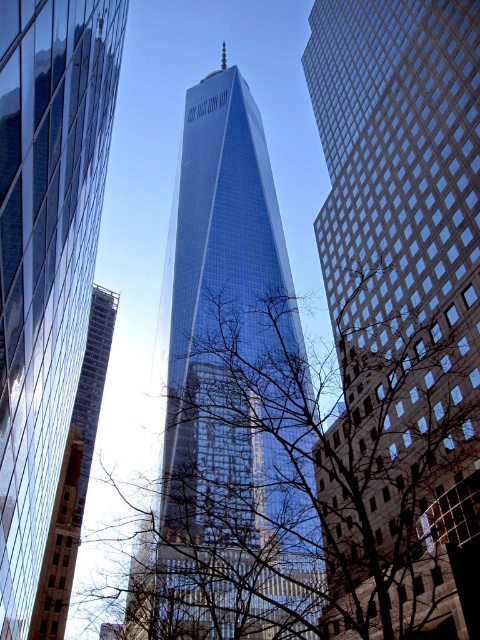
You are standing in the city and want to take a photo of the shiny glass skyscraper at center. If you are positioned at the origin point of the city map, which is at coordinate point 0.5, 0.5, in which direction should you move to frame the skyscraper perfectly in your camera?

The shiny glass skyscraper at center is located at coordinate point (x=231, y=394). Since your current position is at (x=240, y=320), you should move slightly to the right and down to align the skyscraper in your camera frame.

You are a city planner evaluating the urban skyline. Given the presence of the shiny glass skyscraper at center and the brown brick building at left, which one would you identify as the taller structure based on their positions in the image?

The shiny glass skyscraper at center is taller than the brown brick building at left.

You are an architect analyzing the urban layout. Based on the scene, which structure would block the view of the brown brick building at left when standing in front of the glassy blue skyscraper at center?

The glassy blue skyscraper at center is in front of the brown brick building at left, so it would block the view of the brown brick building at left.